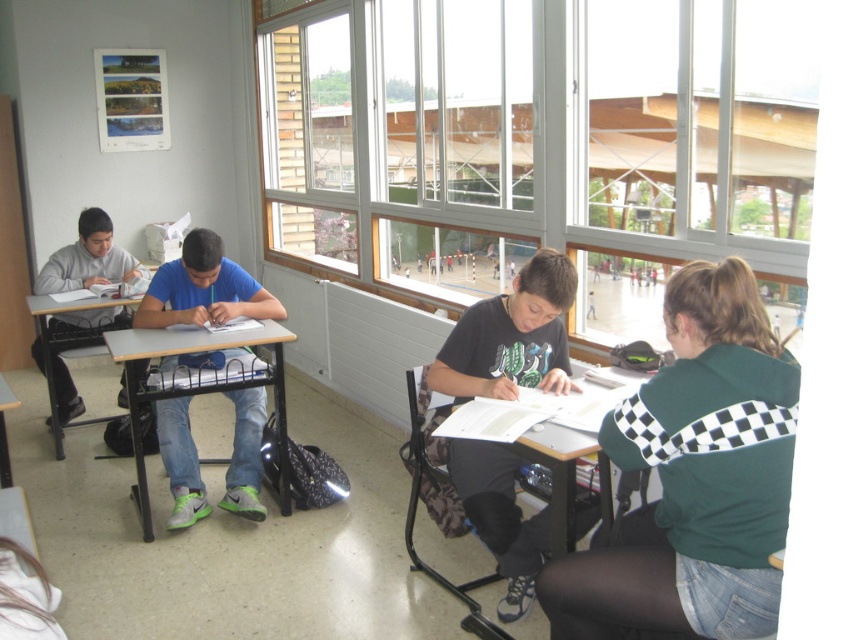
Question: Estimate the real-world distances between objects in this image. Which object is farther from the matte wood table at center?

Choices:
 (A) wooden desk at left
 (B) black matte shirt at center
 (C) matte black desk at lower right
 (D) green checkered jacket at lower right

Answer: (D)

Question: Is green checkered jacket at lower right in front of black matte shirt at center?

Choices:
 (A) yes
 (B) no

Answer: (A)

Question: Estimate the real-world distances between objects in this image. Which object is farther from the matte black desk at lower right?

Choices:
 (A) black matte shirt at center
 (B) green checkered jacket at lower right
 (C) matte wood table at center
 (D) wooden desk at left

Answer: (D)

Question: Is matte wood table at center to the left of wooden desk at left from the viewer's perspective?

Choices:
 (A) yes
 (B) no

Answer: (B)

Question: Among these points, which one is nearest to the camera?

Choices:
 (A) (86, 422)
 (B) (518, 580)
 (C) (465, 444)
 (D) (744, 609)

Answer: (D)

Question: In this image, where is matte black desk at lower right located relative to matte wood table at center?

Choices:
 (A) right
 (B) left

Answer: (A)